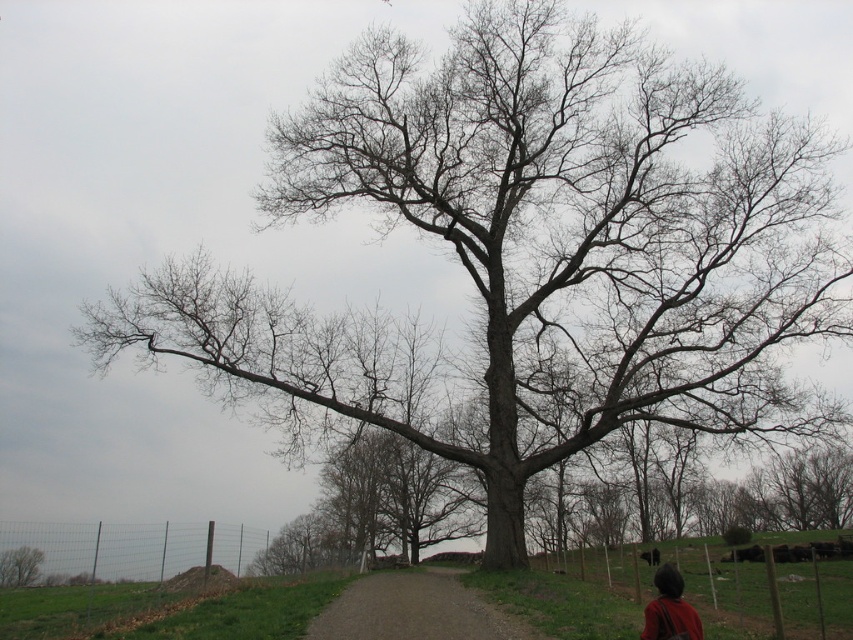
You are standing on the dirt path and see the brown leather backpack at lower right and the bare wood tree at lower left. Which object is closer to you?

The brown leather backpack at lower right is closer to you because it is located above the bare wood tree at lower left, which is further away.

You are standing at the point closest to the camera in the image. Which point, point (426, 616) or point (18, 580), are you currently at?

You are at point (426, 616) because it is closer to the camera than point (18, 580).